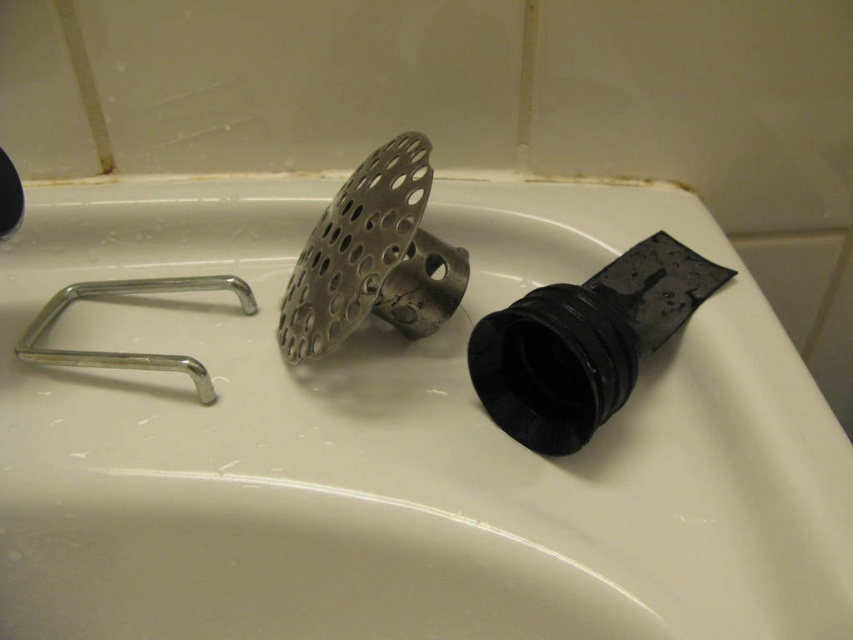
Does white matte sink at center appear under silver metallic faucet at left?

Indeed, white matte sink at center is positioned under silver metallic faucet at left.

Is point (242, 529) closer to viewer compared to point (41, 353)?

Yes, it is.

Who is more distant from viewer, (659, 458) or (47, 307)?

The point (47, 307) is behind.

I want to click on white matte sink at center, so click(397, 442).